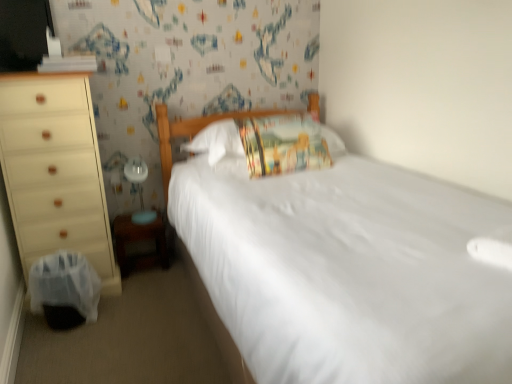
Question: Does wooden changing table at lower left have a greater height compared to black plastic swivel chair at lower left?

Choices:
 (A) yes
 (B) no

Answer: (B)

Question: Would you say wooden changing table at lower left contains black plastic swivel chair at lower left?

Choices:
 (A) no
 (B) yes

Answer: (A)

Question: Are wooden changing table at lower left and black plastic swivel chair at lower left making contact?

Choices:
 (A) no
 (B) yes

Answer: (A)

Question: Considering the relative sizes of wooden changing table at lower left and black plastic swivel chair at lower left in the image provided, is wooden changing table at lower left smaller than black plastic swivel chair at lower left?

Choices:
 (A) no
 (B) yes

Answer: (B)

Question: Can you confirm if wooden changing table at lower left is positioned to the left of black plastic swivel chair at lower left?

Choices:
 (A) yes
 (B) no

Answer: (B)

Question: Considering the positions of wooden changing table at lower left and matte white dresser at left in the image, is wooden changing table at lower left taller or shorter than matte white dresser at left?

Choices:
 (A) tall
 (B) short

Answer: (B)

Question: From a real-world perspective, relative to matte white dresser at left, is wooden changing table at lower left vertically above or below?

Choices:
 (A) below
 (B) above

Answer: (A)

Question: In the image, is wooden changing table at lower left positioned in front of or behind matte white dresser at left?

Choices:
 (A) front
 (B) behind

Answer: (B)

Question: In terms of width, does wooden changing table at lower left look wider or thinner when compared to matte white dresser at left?

Choices:
 (A) thin
 (B) wide

Answer: (A)

Question: From the image's perspective, is printed fabric pillow at center located above or below matte white dresser at left?

Choices:
 (A) above
 (B) below

Answer: (A)

Question: In the image, is printed fabric pillow at center positioned in front of or behind matte white dresser at left?

Choices:
 (A) front
 (B) behind

Answer: (B)

Question: In terms of size, does printed fabric pillow at center appear bigger or smaller than matte white dresser at left?

Choices:
 (A) small
 (B) big

Answer: (A)

Question: Is printed fabric pillow at center situated inside matte white dresser at left or outside?

Choices:
 (A) outside
 (B) inside

Answer: (A)

Question: Does point (136, 215) appear closer or farther from the camera than point (121, 276)?

Choices:
 (A) closer
 (B) farther

Answer: (B)

Question: Looking at their shapes, would you say white glossy table lamp at lower left is wider or thinner than wooden changing table at lower left?

Choices:
 (A) thin
 (B) wide

Answer: (A)